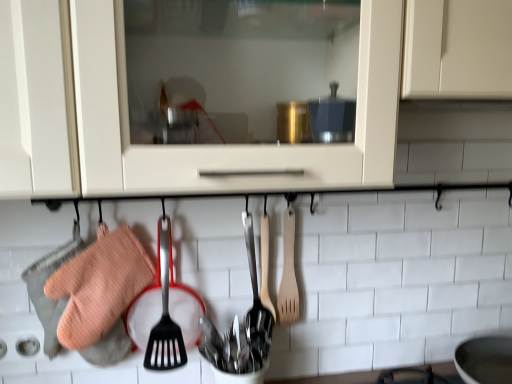
Question: Can you confirm if orange waffle oven mitt at left is wider than polished stainless steel cutlery at center, which is the second silverware in top-to-bottom order?

Choices:
 (A) no
 (B) yes

Answer: (A)

Question: Is orange waffle oven mitt at left thinner than polished stainless steel cutlery at center, marked as the first silverware in a bottom-to-top arrangement?

Choices:
 (A) yes
 (B) no

Answer: (A)

Question: Is orange waffle oven mitt at left next to polished stainless steel cutlery at center, marked as the first silverware in a bottom-to-top arrangement?

Choices:
 (A) yes
 (B) no

Answer: (B)

Question: From a real-world perspective, is orange waffle oven mitt at left physically above polished stainless steel cutlery at center, marked as the first silverware in a bottom-to-top arrangement?

Choices:
 (A) no
 (B) yes

Answer: (B)

Question: Is orange waffle oven mitt at left at the left side of polished stainless steel cutlery at center, marked as the first silverware in a bottom-to-top arrangement?

Choices:
 (A) no
 (B) yes

Answer: (B)

Question: Is polished stainless steel spoons at center, acting as the second silverware starting from the bottom, taller or shorter than polished stainless steel cutlery at center, marked as the first silverware in a bottom-to-top arrangement?

Choices:
 (A) short
 (B) tall

Answer: (B)

Question: Is polished stainless steel spoons at center, acting as the second silverware starting from the bottom, inside the boundaries of polished stainless steel cutlery at center, marked as the first silverware in a bottom-to-top arrangement, or outside?

Choices:
 (A) inside
 (B) outside

Answer: (B)

Question: From a real-world perspective, is polished stainless steel spoons at center, acting as the second silverware starting from the bottom, positioned above or below polished stainless steel cutlery at center, marked as the first silverware in a bottom-to-top arrangement?

Choices:
 (A) below
 (B) above

Answer: (B)

Question: From the image's perspective, relative to polished stainless steel cutlery at center, marked as the first silverware in a bottom-to-top arrangement, is polished stainless steel spoons at center, acting as the second silverware starting from the bottom, above or below?

Choices:
 (A) above
 (B) below

Answer: (A)

Question: Considering the positions of point (266, 292) and point (245, 223), is point (266, 292) closer or farther from the camera than point (245, 223)?

Choices:
 (A) closer
 (B) farther

Answer: (B)

Question: From a real-world perspective, is wooden spatula at center, which is the second spatula in right-to-left order, physically located above or below polished stainless steel spoons at center, acting as the second silverware starting from the bottom?

Choices:
 (A) above
 (B) below

Answer: (A)

Question: Which is correct: wooden spatula at center, the first spatula positioned from the left, is inside polished stainless steel spoons at center, which ranks as the 1th silverware in top-to-bottom order, or outside of it?

Choices:
 (A) inside
 (B) outside

Answer: (A)

Question: Considering the positions of wooden spatula at center, which is the second spatula in right-to-left order, and polished stainless steel spoons at center, acting as the second silverware starting from the bottom, in the image, is wooden spatula at center, which is the second spatula in right-to-left order, bigger or smaller than polished stainless steel spoons at center, acting as the second silverware starting from the bottom,?

Choices:
 (A) small
 (B) big

Answer: (A)

Question: In terms of width, does wooden spatula at center, which is the second spatula in right-to-left order, look wider or thinner when compared to orange waffle oven mitt at left?

Choices:
 (A) thin
 (B) wide

Answer: (A)

Question: From the image's perspective, is wooden spatula at center, which is the second spatula in right-to-left order, above or below orange waffle oven mitt at left?

Choices:
 (A) above
 (B) below

Answer: (A)